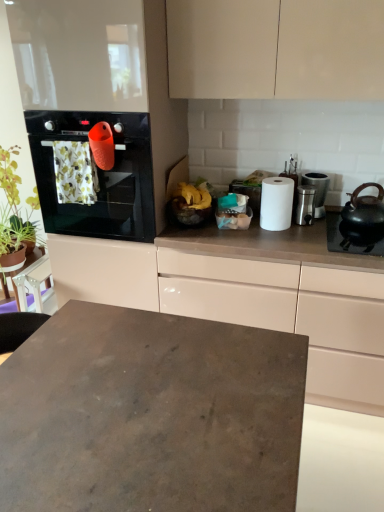
This screenshot has width=384, height=512. Identify the location of vacant area that lies to the right of white matte paper towel at center. (315, 230).